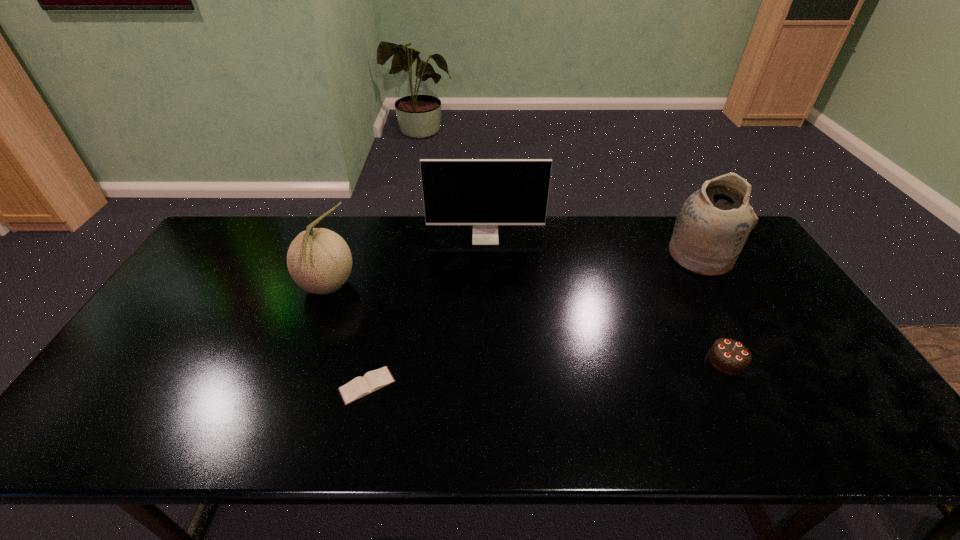
The image size is (960, 540). I want to click on vacant area between the monitor and the shortest object, so click(x=426, y=311).

Locate an element on the screen. The height and width of the screenshot is (540, 960). vacant area that lies between the fourth object from right to left and the leftmost object is located at coordinates (348, 336).

At what (x,y) coordinates should I click in order to perform the action: click on free spot between the diary and the leftmost object. Please return your answer as a coordinate pair (x, y). Image resolution: width=960 pixels, height=540 pixels. Looking at the image, I should click on (348, 336).

What are the coordinates of `vacant area between the pottery and the shortest object` in the screenshot? It's located at [534, 321].

This screenshot has width=960, height=540. Identify the location of free space between the leftmost object and the pottery. (514, 272).

At what (x,y) coordinates should I click in order to perform the action: click on vacant space that is in between the leftmost object and the fourth object from right to left. Please return your answer as a coordinate pair (x, y). The width and height of the screenshot is (960, 540). Looking at the image, I should click on (348, 336).

At what (x,y) coordinates should I click in order to perform the action: click on empty space that is in between the diary and the chocolate cake. Please return your answer as a coordinate pair (x, y). The image size is (960, 540). Looking at the image, I should click on (547, 373).

Identify the location of free space between the diary and the third object from left to right. The width and height of the screenshot is (960, 540). (426, 311).

Where is `vacant area that lies between the fourth tallest object and the third object from left to right`? vacant area that lies between the fourth tallest object and the third object from left to right is located at coordinates (606, 299).

The height and width of the screenshot is (540, 960). Identify the location of object that ranks as the fourth closest to the cantaloup. (713, 224).